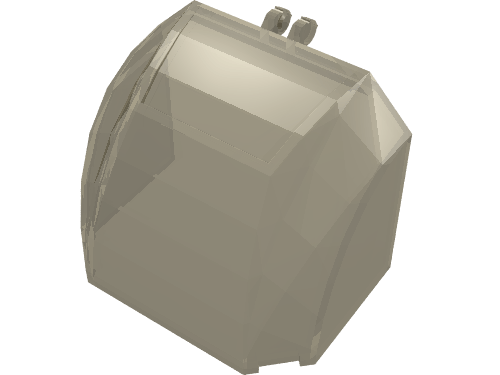
At what (x,y) coordinates should I click in order to perform the action: click on hinges. Please return your answer as a coordinate pair (x, y). This screenshot has width=500, height=375. Looking at the image, I should click on (295, 25), (272, 19).